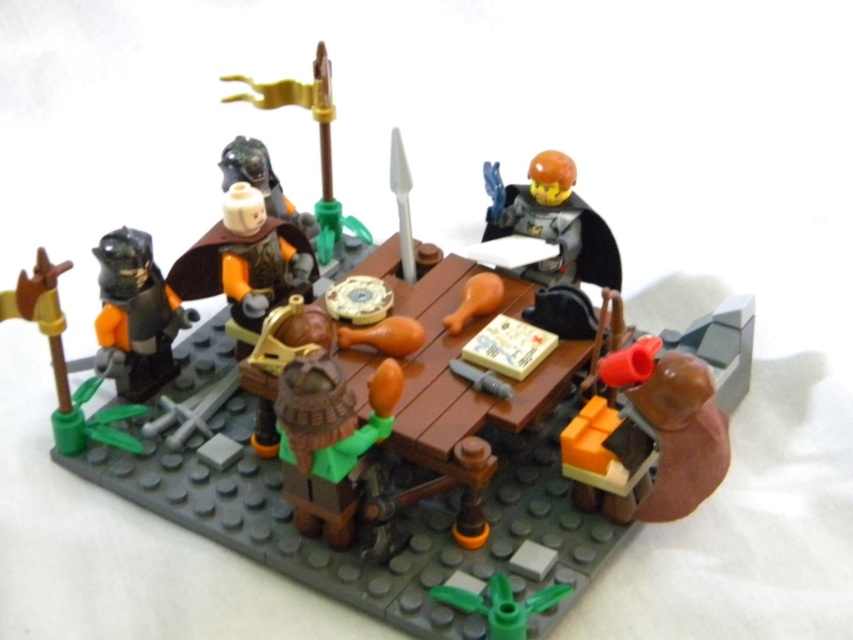
Does smooth orange cape at center have a greater height compared to gold metallic flagpole at upper center?

No.

Does smooth orange cape at center appear under gold metallic flagpole at upper center?

Correct, smooth orange cape at center is located below gold metallic flagpole at upper center.

You are a GUI agent. You are given a task and a screenshot of the screen. Output one action in this format:
    pyautogui.click(x=<x>, y=<y>)
    Task: Click on the smooth orange cape at center
    
    Given the screenshot: What is the action you would take?
    (x=245, y=259)

What do you see at coordinates (328, 440) in the screenshot? I see `brown matte helmet at center` at bounding box center [328, 440].

Does point (287, 460) come farther from viewer compared to point (589, 275)?

No, it is in front of (589, 275).

Does point (294, 468) lie behind point (592, 227)?

No, (294, 468) is closer to viewer.

Locate an element on the screen. brown matte helmet at center is located at coordinates (328, 440).

Locate an element on the screen. This screenshot has width=853, height=640. metallic silver helmet at upper right is located at coordinates (552, 221).

Is metallic silver helmet at upper right shorter than gold metallic flagpole at upper center?

Indeed, metallic silver helmet at upper right has a lesser height compared to gold metallic flagpole at upper center.

Where is `metallic silver helmet at upper right`? metallic silver helmet at upper right is located at coordinates (552, 221).